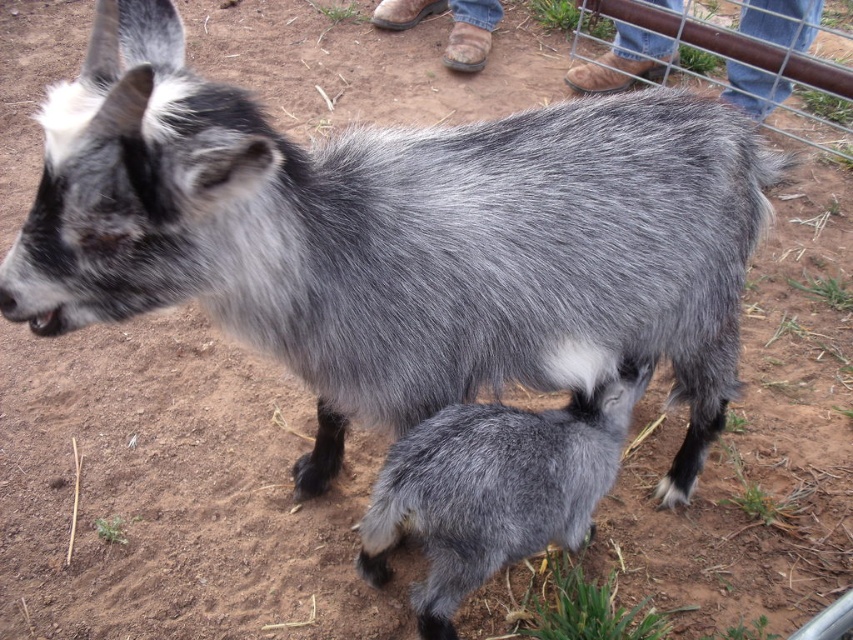
Is point (492, 518) positioned after point (834, 12)?

That is False.

Does gray woolen goat at lower center appear over metal wire fence at upper right?

Actually, gray woolen goat at lower center is below metal wire fence at upper right.

Is point (627, 364) positioned behind point (695, 29)?

No, (627, 364) is in front of (695, 29).

The height and width of the screenshot is (640, 853). Identify the location of gray woolen goat at lower center. (494, 490).